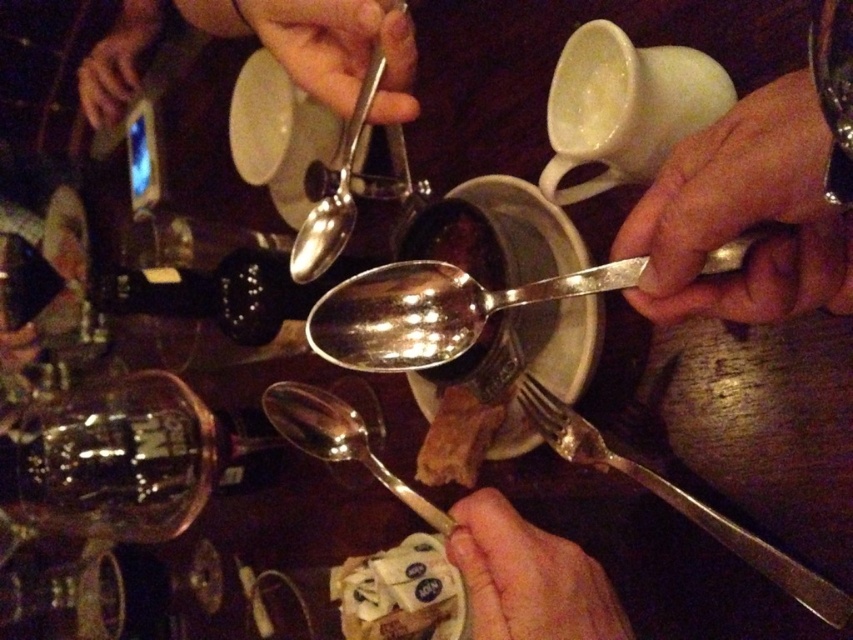
Question: Which object is closer to the camera taking this photo?

Choices:
 (A) silver metallic fork at lower right
 (B) polished silver spoon at center
 (C) smooth skin hand at lower center

Answer: (B)

Question: Which point appears closest to the camera in this image?

Choices:
 (A) (844, 129)
 (B) (125, 80)
 (C) (334, 340)

Answer: (A)

Question: Is silver metallic spoon at upper right thinner than silver metallic fork at lower right?

Choices:
 (A) no
 (B) yes

Answer: (B)

Question: Which object appears closest to the camera in this image?

Choices:
 (A) shiny silver spoon at center
 (B) metallic silver spoon at upper center

Answer: (A)

Question: Does smooth skin hand at lower center have a greater width compared to shiny silver spoon at upper center?

Choices:
 (A) yes
 (B) no

Answer: (B)

Question: Does metallic silver spoon at upper center have a smaller size compared to silver metallic fork at lower right?

Choices:
 (A) yes
 (B) no

Answer: (A)